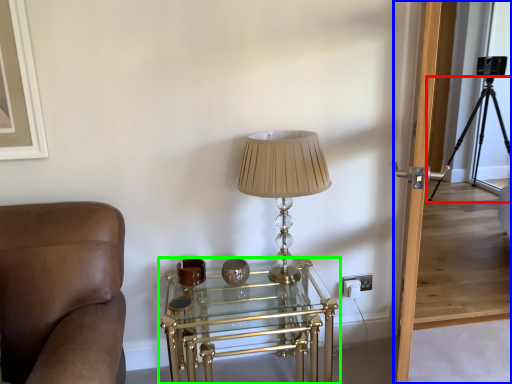
Question: Considering the real-world distances, which object is farthest from tripod (highlighted by a red box)? glass door (highlighted by a blue box) or table (highlighted by a green box)?

Choices:
 (A) glass door
 (B) table

Answer: (B)